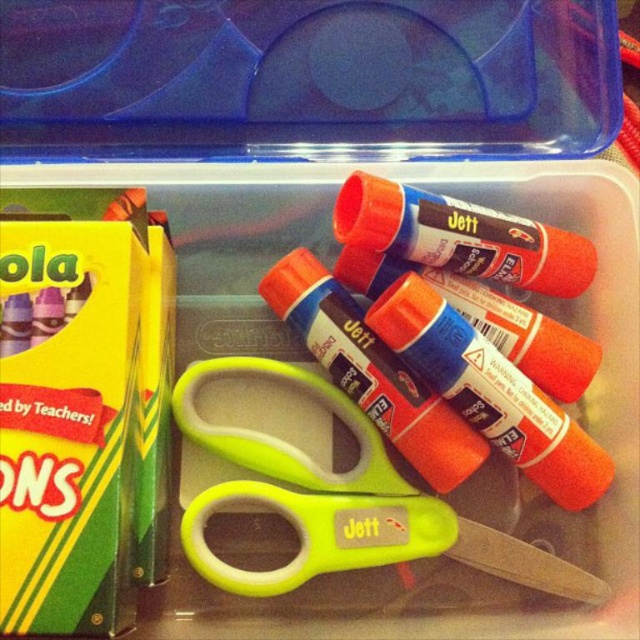
How much distance is there between green plastic scissors at center and matte black glue stick at center?

A distance of 13.36 inches exists between green plastic scissors at center and matte black glue stick at center.

Is green plastic scissors at center to the right of matte black glue stick at center from the viewer's perspective?

In fact, green plastic scissors at center is to the left of matte black glue stick at center.

The height and width of the screenshot is (640, 640). What do you see at coordinates (330, 490) in the screenshot?
I see `green plastic scissors at center` at bounding box center [330, 490].

Locate an element on the screen. The image size is (640, 640). green plastic scissors at center is located at coordinates (330, 490).

Can you confirm if matte orange glue stick at center is thinner than matte black glue stick at center?

Correct, matte orange glue stick at center's width is less than matte black glue stick at center's.

Does point (374, 323) come closer to viewer compared to point (573, 260)?

That is True.

Which is behind, point (416, 320) or point (497, 273)?

Positioned behind is point (497, 273).

I want to click on matte orange glue stick at center, so click(x=490, y=392).

From the picture: Who is taller, green plastic scissors at center or matte orange glue stick at center?

green plastic scissors at center is taller.

Is green plastic scissors at center smaller than matte orange glue stick at center?

No, green plastic scissors at center is not smaller than matte orange glue stick at center.

The width and height of the screenshot is (640, 640). What are the coordinates of `green plastic scissors at center` in the screenshot? It's located at (330, 490).